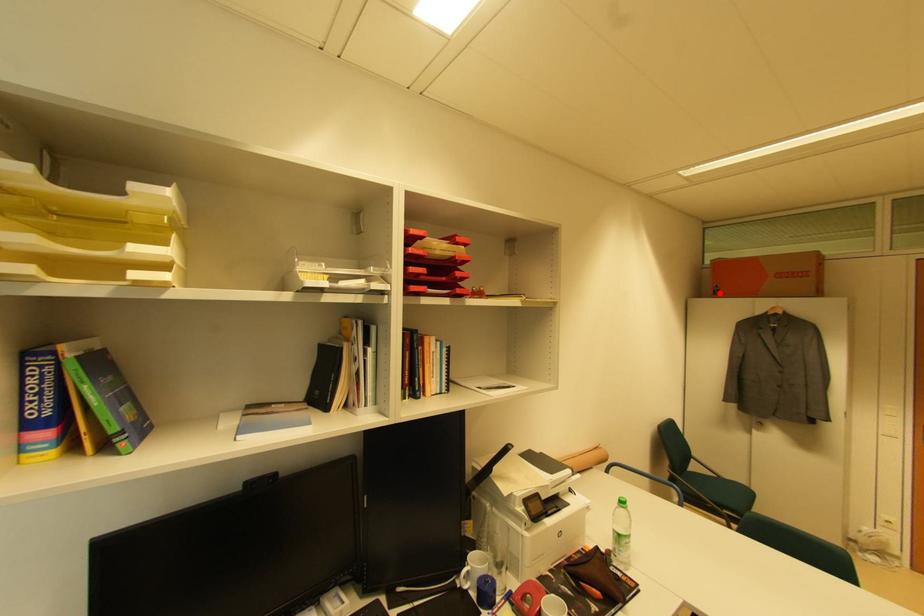
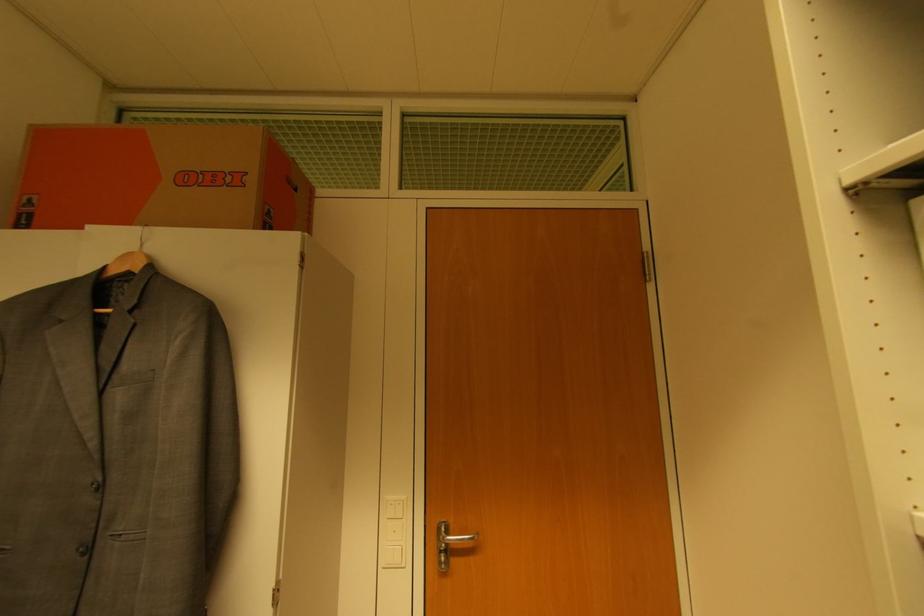
Question: I am providing you with two images of the same scene from different viewpoints. A red point is marked on the first image. Is the red point's position out of view in image 2?

Choices:
 (A) Yes
 (B) No

Answer: (B)